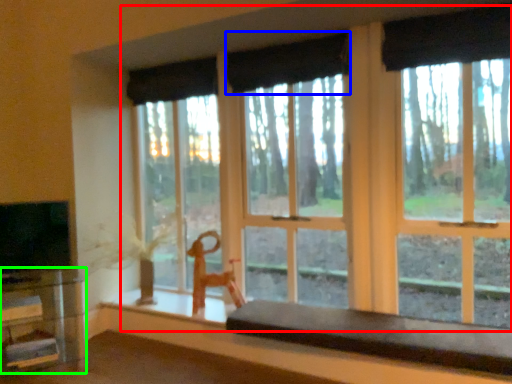
Question: Considering the real-world distances, which object is closest to window (highlighted by a red box)? curtain (highlighted by a blue box) or table (highlighted by a green box).

Choices:
 (A) curtain
 (B) table

Answer: (A)